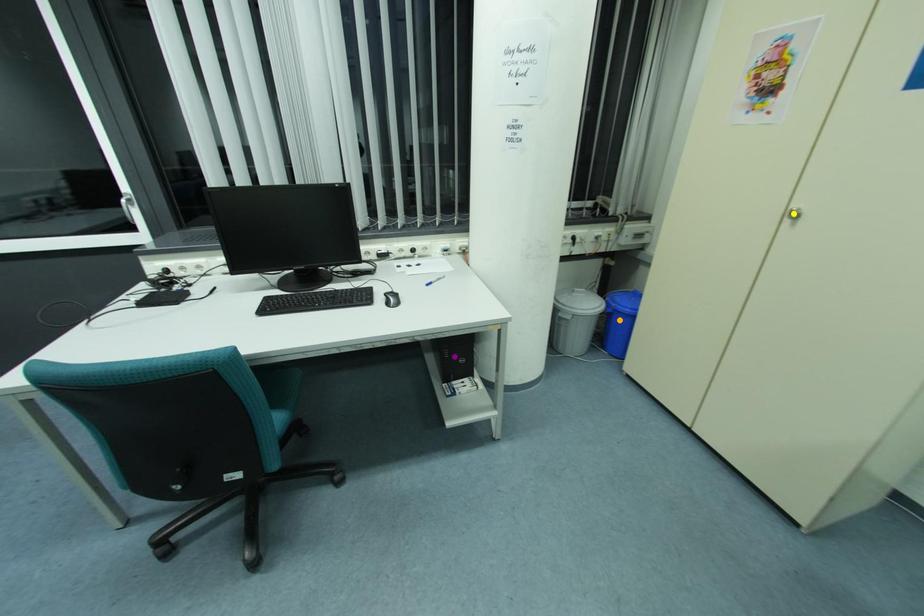
Order these from nearest to farthest:
- purple point
- yellow point
- orange point

yellow point, purple point, orange point